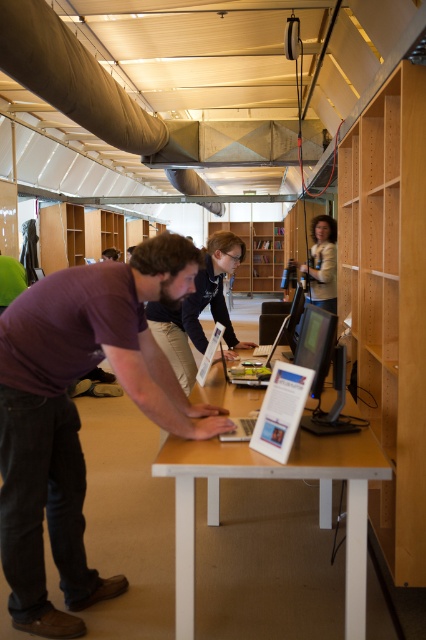
Question: Does purple cotton shirt at center come in front of silver metallic laptop at center?

Choices:
 (A) yes
 (B) no

Answer: (B)

Question: Which object is positioned closest to the wooden bookshelf at center?

Choices:
 (A) light wood bookshelf at right
 (B) matte black camera at upper center
 (C) silver metallic laptop at center
 (D) purple cotton shirt at center

Answer: (B)

Question: Does wooden table at center have a lesser width compared to matte black camera at upper center?

Choices:
 (A) no
 (B) yes

Answer: (A)

Question: Which point is closer to the camera?

Choices:
 (A) silver metallic laptop at center
 (B) light wood bookshelf at right
 (C) wooden table at center

Answer: (C)

Question: Does purple cotton shirt at center come behind wooden bookshelf at center?

Choices:
 (A) no
 (B) yes

Answer: (A)

Question: Which object appears closest to the camera in this image?

Choices:
 (A) wooden bookshelf at center
 (B) purple cotton shirt at center
 (C) light wood bookshelf at right
 (D) silver metallic laptop at center

Answer: (D)